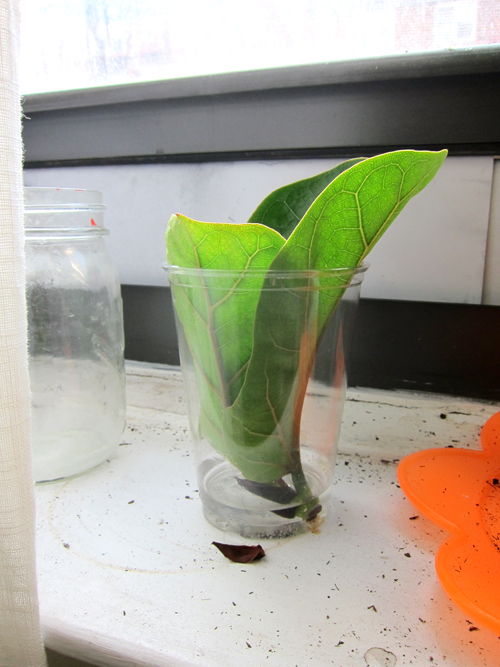
Where is `window`? This screenshot has height=667, width=500. window is located at coordinates (304, 25).